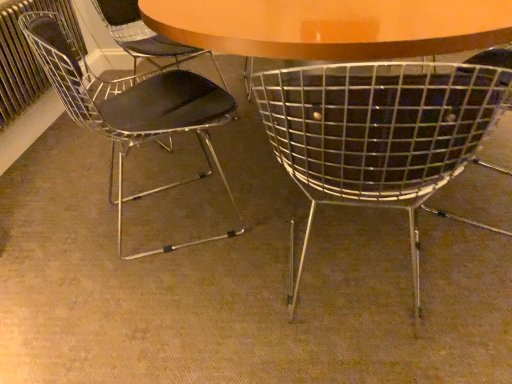
Locate an element on the screen. The height and width of the screenshot is (384, 512). blank space to the left of metal mesh chair at center, which is the second chair in left-to-right order is located at coordinates (218, 298).